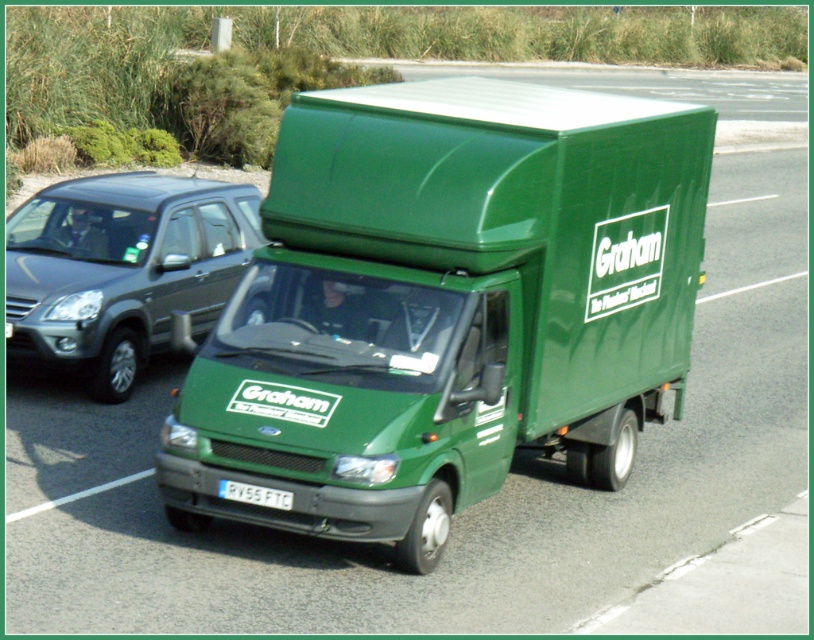
Question: Is green matte truck at center bigger than white plastic license plate at center?

Choices:
 (A) yes
 (B) no

Answer: (A)

Question: Estimate the real-world distances between objects in this image. Which object is closer to the white plastic license plate at center?

Choices:
 (A) green matte truck at center
 (B) metallic gray suv at left

Answer: (A)

Question: Which object appears farthest from the camera in this image?

Choices:
 (A) green matte truck at center
 (B) metallic gray suv at left
 (C) white plastic license plate at center

Answer: (B)

Question: Which point is farther to the camera?

Choices:
 (A) green matte truck at center
 (B) white plastic license plate at center

Answer: (B)

Question: Can you confirm if green matte truck at center is positioned to the left of metallic gray suv at left?

Choices:
 (A) no
 (B) yes

Answer: (A)

Question: Is metallic gray suv at left smaller than white plastic license plate at center?

Choices:
 (A) no
 (B) yes

Answer: (A)